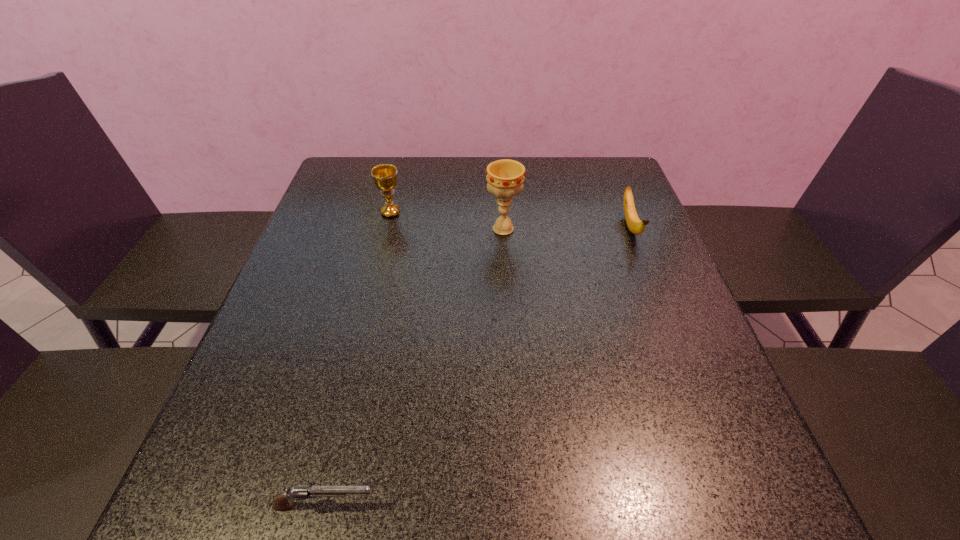
At what (x,y) coordinates should I click in order to perform the action: click on free space between the nearest object and the banana. Please return your answer as a coordinate pair (x, y). Looking at the image, I should click on (478, 366).

This screenshot has height=540, width=960. In order to click on vacant area between the shortest object and the shorter chalice in this screenshot , I will do `click(358, 359)`.

The image size is (960, 540). I want to click on free spot between the tallest object and the gun, so click(414, 367).

Image resolution: width=960 pixels, height=540 pixels. In order to click on the third closest object relative to the third shortest object in this screenshot , I will do `click(282, 501)`.

I want to click on the closest object to the banana, so click(505, 177).

The height and width of the screenshot is (540, 960). I want to click on vacant space that satisfies the following two spatial constraints: 1. at the stem of the rightmost object; 2. aiming along the barrel of the nearest object, so click(x=741, y=505).

In order to click on free spot that satisfies the following two spatial constraints: 1. at the stem of the rightmost object; 2. aiming along the barrel of the nearest object in this screenshot , I will do `click(741, 505)`.